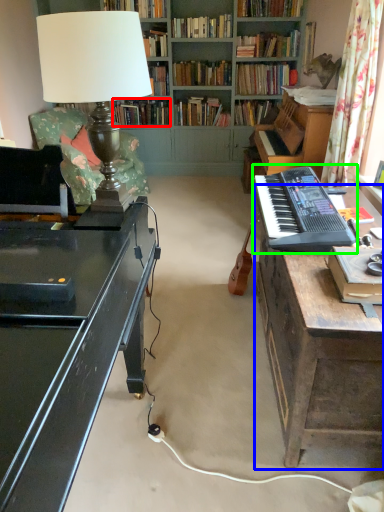
Question: Considering the real-world distances, which object is closest to book (highlighted by a red box)? table (highlighted by a blue box) or musical keyboard (highlighted by a green box).

Choices:
 (A) table
 (B) musical keyboard

Answer: (B)